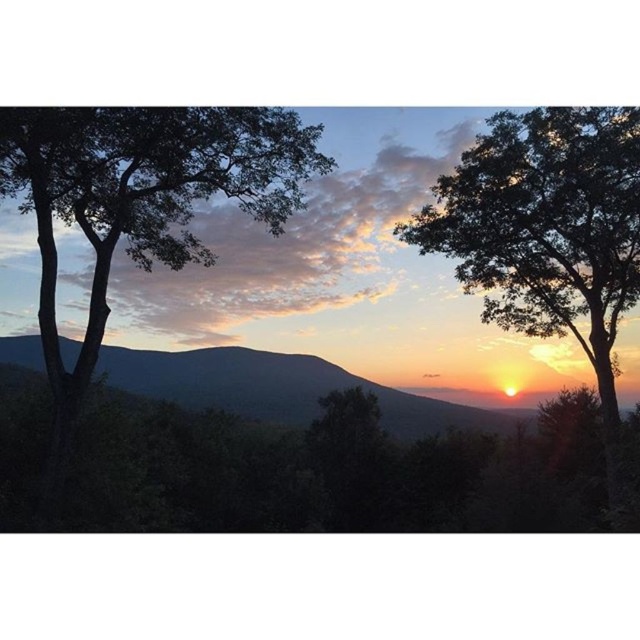
Question: Which of the following is the farthest from the observer?

Choices:
 (A) pos(58,476)
 (B) pos(243,412)

Answer: (B)

Question: Which point is farther from the camera taking this photo?

Choices:
 (A) (8, 356)
 (B) (614, 241)
 (C) (49, 305)

Answer: (A)

Question: Observing the image, what is the correct spatial positioning of green leafy tree at right in reference to silvery metallic mountain at center?

Choices:
 (A) right
 (B) left

Answer: (A)

Question: From the image, what is the correct spatial relationship of green leafy tree at left in relation to silvery metallic mountain at center?

Choices:
 (A) right
 (B) left

Answer: (B)

Question: Which object is farther from the camera taking this photo?

Choices:
 (A) green leafy tree at left
 (B) silvery metallic mountain at center

Answer: (B)

Question: Does green leafy tree at left appear on the right side of silvery metallic mountain at center?

Choices:
 (A) no
 (B) yes

Answer: (A)